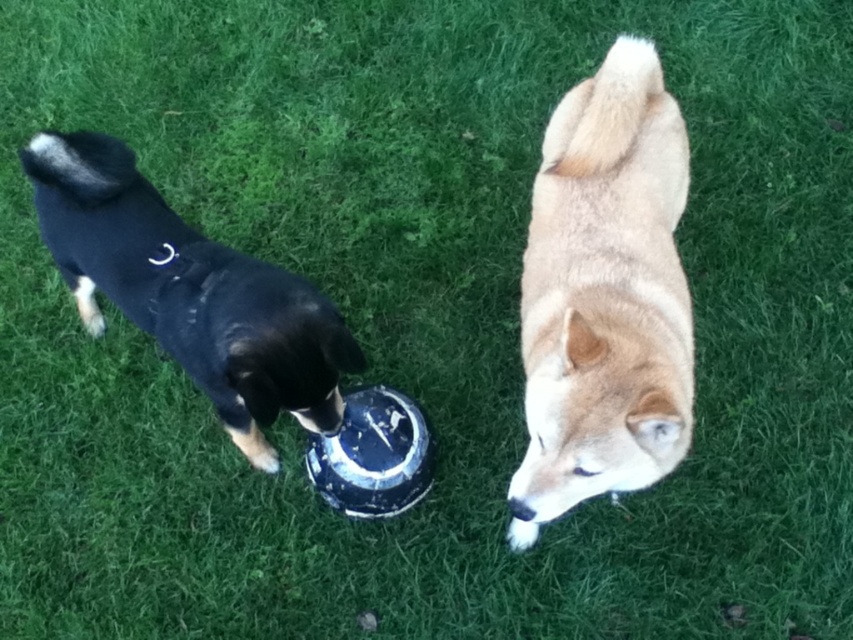
Question: From the image, what is the correct spatial relationship of light brown fur dog at upper right in relation to black matte dog at left?

Choices:
 (A) right
 (B) left

Answer: (A)

Question: Which of the following is the farthest from the observer?

Choices:
 (A) (135, 317)
 (B) (543, 516)

Answer: (A)

Question: Does light brown fur dog at upper right have a larger size compared to black matte dog at left?

Choices:
 (A) no
 (B) yes

Answer: (A)

Question: Which point is closer to the camera taking this photo?

Choices:
 (A) (67, 220)
 (B) (630, 324)

Answer: (B)

Question: Does light brown fur dog at upper right appear on the right side of black matte dog at left?

Choices:
 (A) yes
 (B) no

Answer: (A)